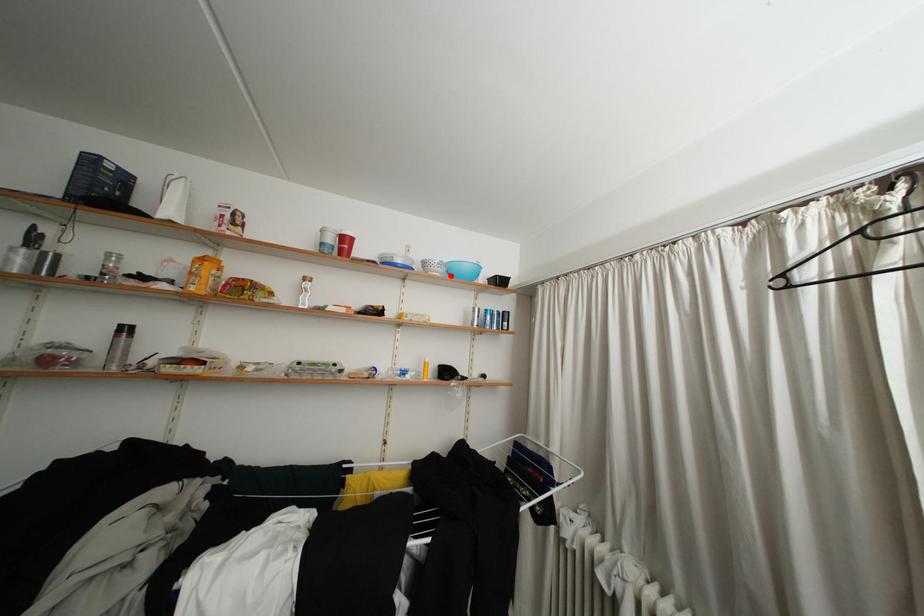
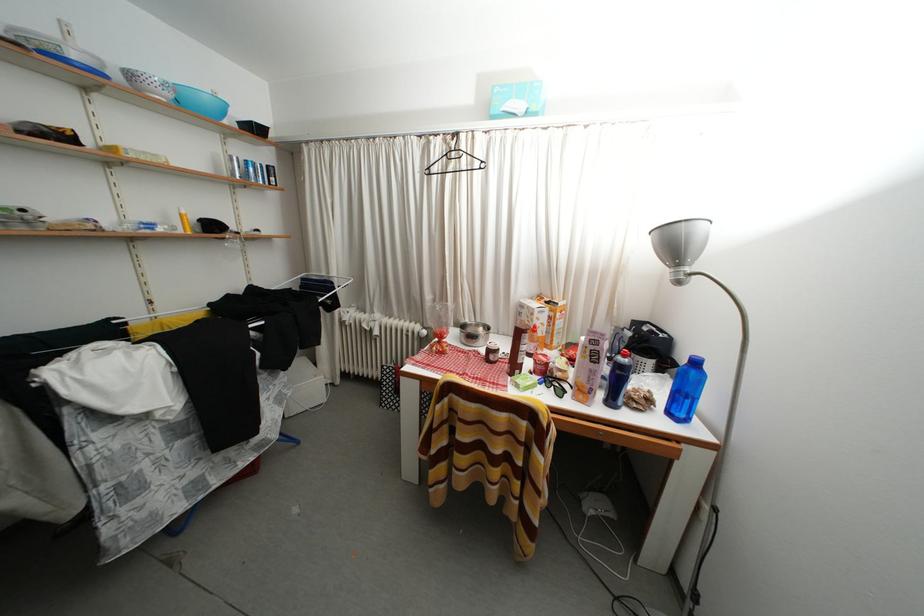
The point at the highlighted location is marked in the first image. Where is the corresponding point in the second image?

(178, 100)